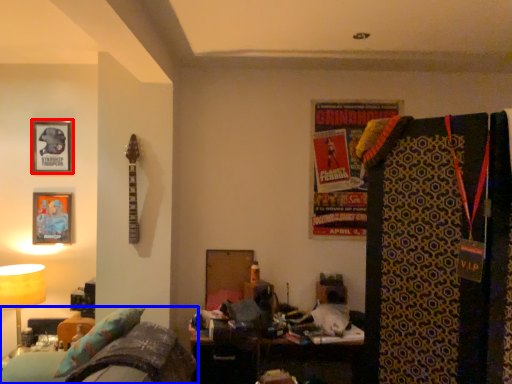
Question: Which object appears farthest to the camera in this image, picture frame (highlighted by a red box) or furniture (highlighted by a blue box)?

Choices:
 (A) picture frame
 (B) furniture

Answer: (A)